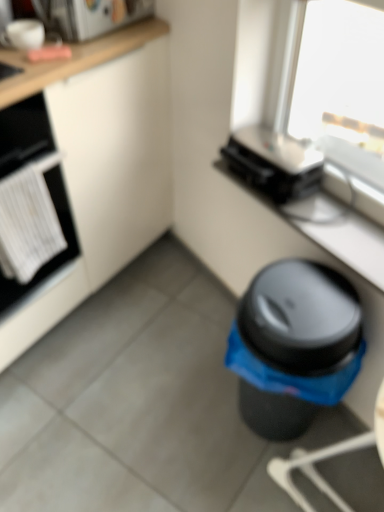
Identify the location of vacant space situated above matte black toaster at upper right (from a real-world perspective). This screenshot has width=384, height=512. (327, 220).